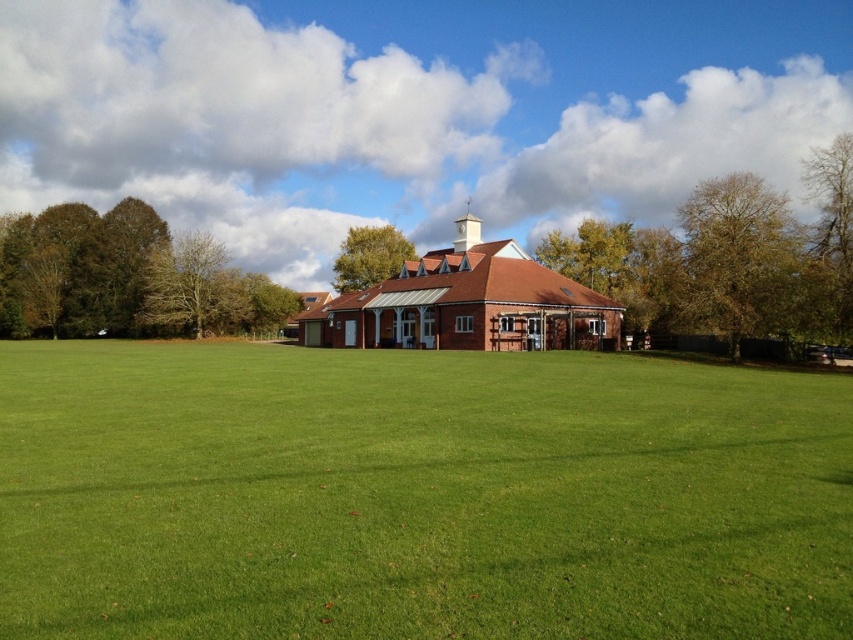
You are standing at the point marked as point (364, 515) and want to walk towards the point marked as point (769, 260). Considering the scene described, will you have an unobstructed path directly between these two points?

Since point (364, 515) is in front of point (769, 260), the path between them is unobstructed.

You are standing at the edge of the grassy field in the scene. If you walk straight towards the center of the field, what will you find at the point marked by coordinates (416, 493)?

At the coordinates (416, 493), you will find green grass at center.

You are standing in the grassy field and want to walk towards the brick building with the clock tower. There are two brown leafy trees in your path. Which tree, the brown leafy tree at upper right or the brown leafy tree at right, is closer to the building?

The brown leafy tree at upper right is closer to the brick building with the clock tower because it is positioned below the brown leafy tree at right, meaning it is nearer to the building in the background.